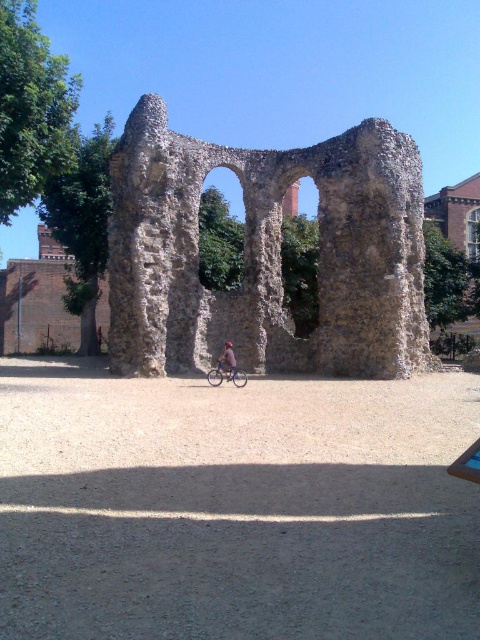
Question: Estimate the real-world distances between objects in this image. Which object is closer to the shiny metallic bicycle at center?

Choices:
 (A) blue fabric bicycle at center
 (B) stone arches at center

Answer: (A)

Question: Does shiny metallic bicycle at center have a greater width compared to blue fabric bicycle at center?

Choices:
 (A) yes
 (B) no

Answer: (A)

Question: Considering the relative positions of stone arches at center and blue fabric bicycle at center in the image provided, where is stone arches at center located with respect to blue fabric bicycle at center?

Choices:
 (A) left
 (B) right

Answer: (B)

Question: Which object appears closest to the camera in this image?

Choices:
 (A) stone arches at center
 (B) shiny metallic bicycle at center
 (C) blue fabric bicycle at center

Answer: (B)

Question: Which point is closer to the camera taking this photo?

Choices:
 (A) (229, 369)
 (B) (151, 353)

Answer: (A)

Question: Is stone arches at center further to camera compared to blue fabric bicycle at center?

Choices:
 (A) no
 (B) yes

Answer: (B)